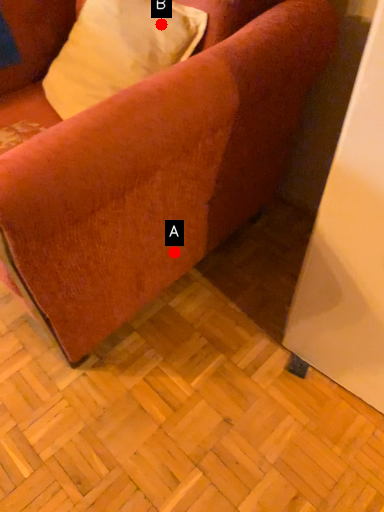
Question: Two points are circled on the image, labeled by A and B beside each circle. Which point is farther to the camera?

Choices:
 (A) A is further
 (B) B is further

Answer: (A)